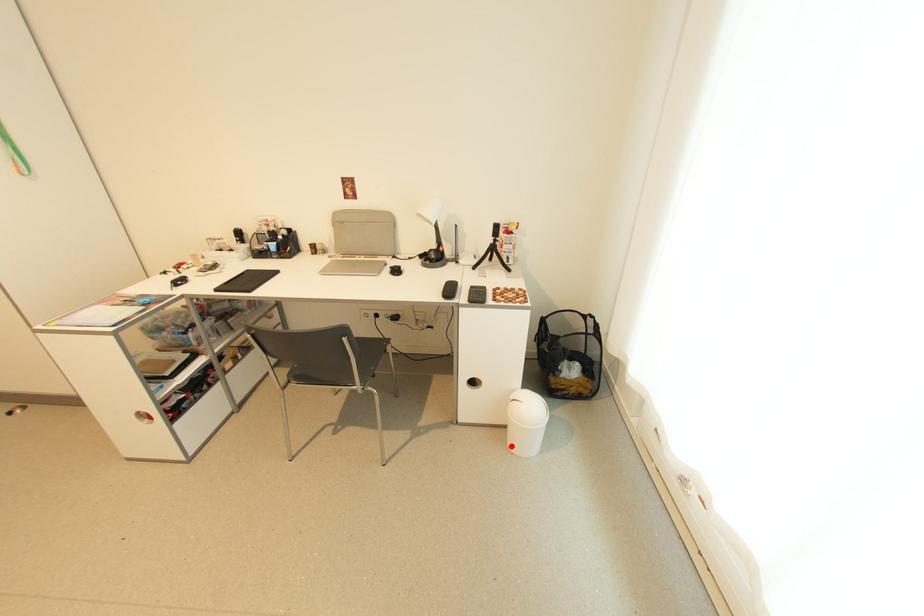
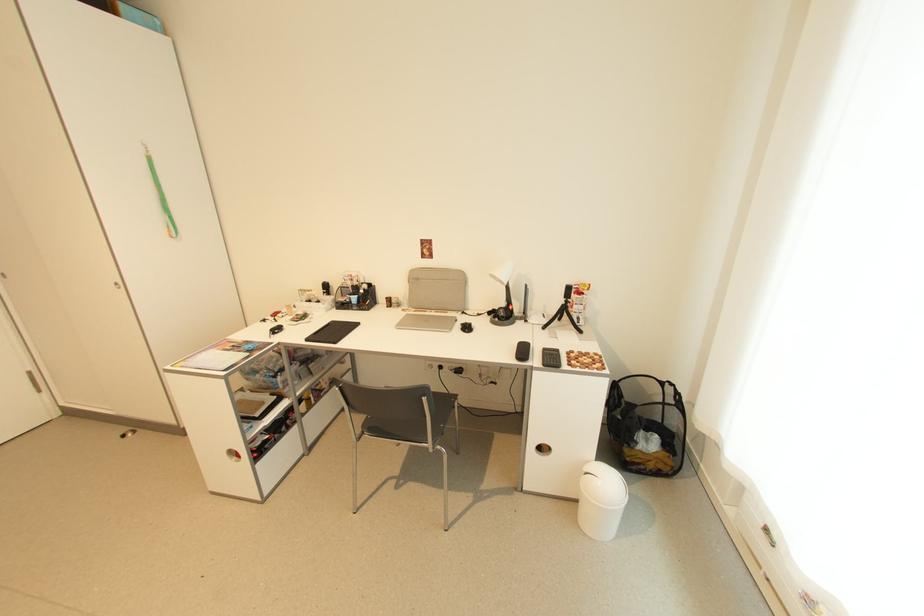
Question: I am providing you with two images of the same scene from different viewpoints. A red point is shown in image1. For the corresponding object point in image2, is it positioned nearer or farther from the camera?

Choices:
 (A) Nearer
 (B) Farther

Answer: (A)